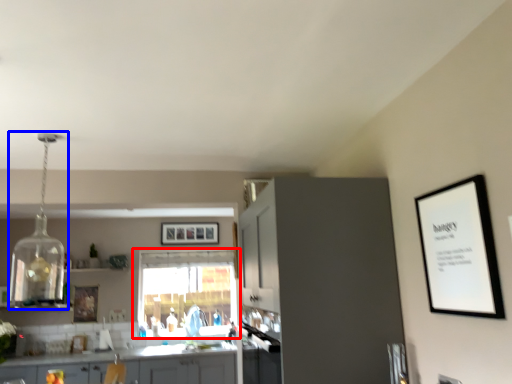
Question: Which object is further to the camera taking this photo, window (highlighted by a red box) or light fixture (highlighted by a blue box)?

Choices:
 (A) window
 (B) light fixture

Answer: (A)